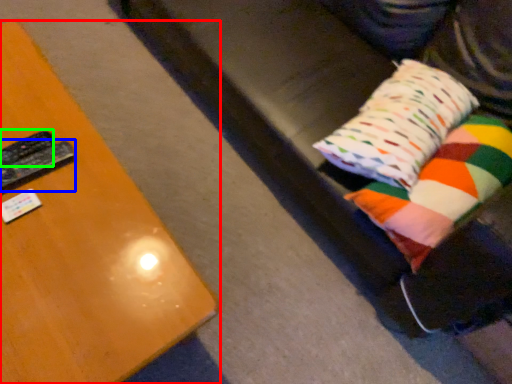
Question: Which object is the closest to the furniture (highlighted by a red box)? Choose among these: remote (highlighted by a blue box) or remote (highlighted by a green box).

Choices:
 (A) remote
 (B) remote

Answer: (A)